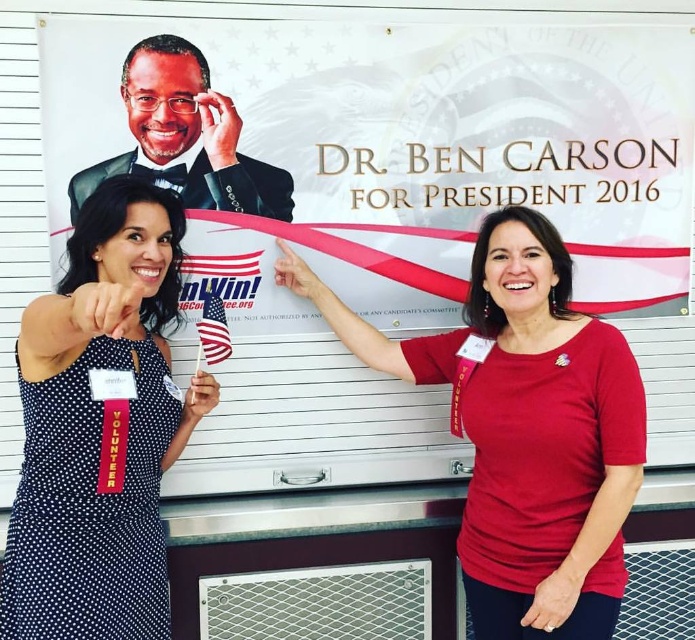
You are a photographer at the event and need to capture a photo that includes both the white paperboard at upper center and the black dotted dress at left. Based on their sizes, which object should you focus on first to ensure both fit in the frame?

The white paperboard at upper center is wider than the black dotted dress at left, so you should focus on positioning the camera to include the wider white paperboard at upper center first to ensure both objects fit in the frame.

Consider the image. You are a photographer at the event and need to capture a clear photo of both the white paperboard at upper center and the black dotted dress at left. Can you position yourself so that both are fully visible without any obstruction?

The black dotted dress at left is behind the white paperboard at upper center, so positioning yourself to the side or angle where the white paperboard does not block the view of the black dotted dress at left would allow both to be visible.